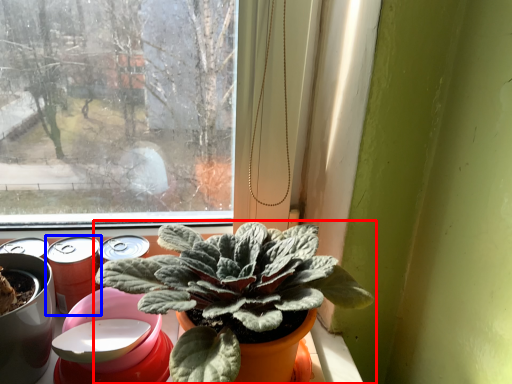
Question: Which object appears closest to the camera in this image, houseplant (highlighted by a red box) or beer (highlighted by a blue box)?

Choices:
 (A) houseplant
 (B) beer

Answer: (A)